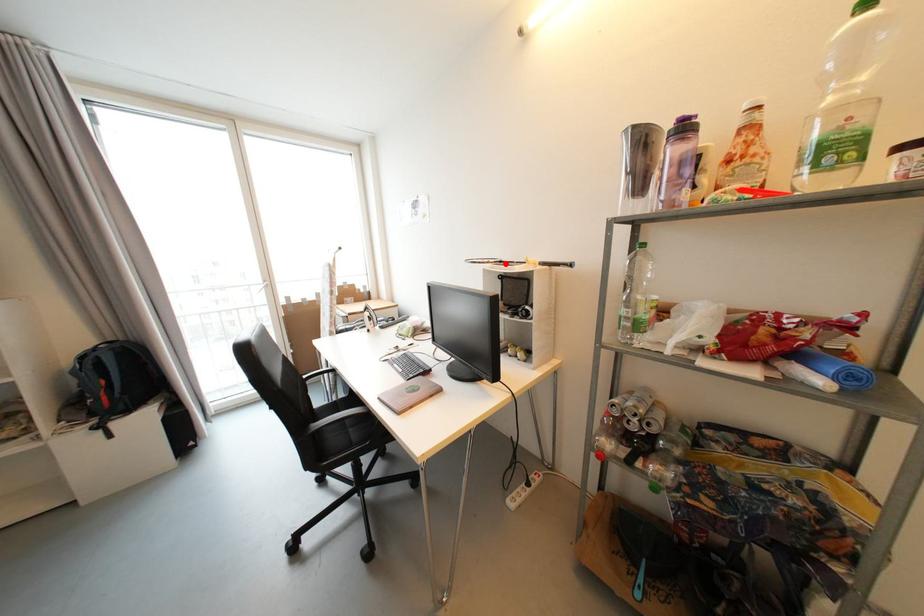
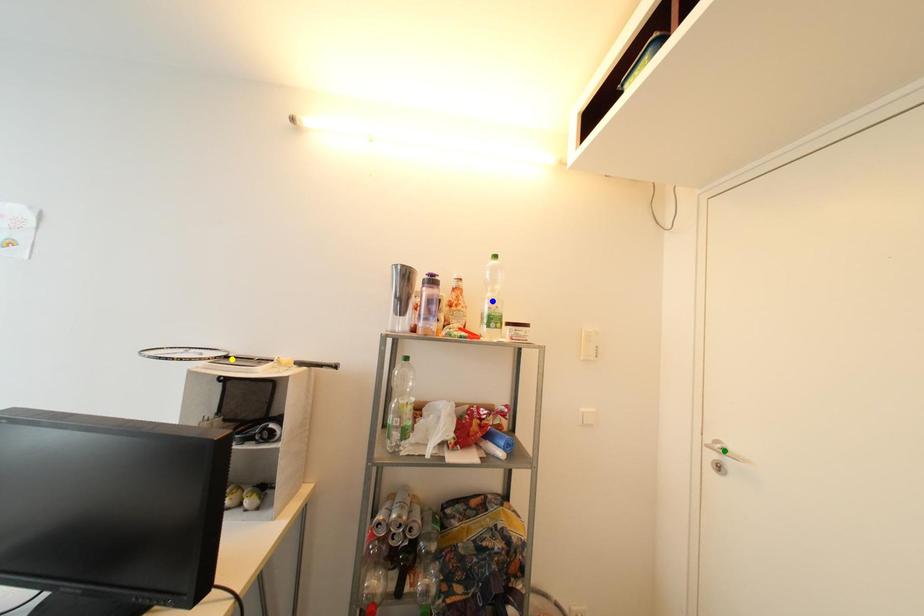
Question: I am providing you with two images of the same scene from different viewpoints. A red point is marked on the first image. You are given multiple points on the second image. Which spot in image 2 lines up with the point in image 1?

Choices:
 (A) green point
 (B) yellow point
 (C) blue point

Answer: (B)